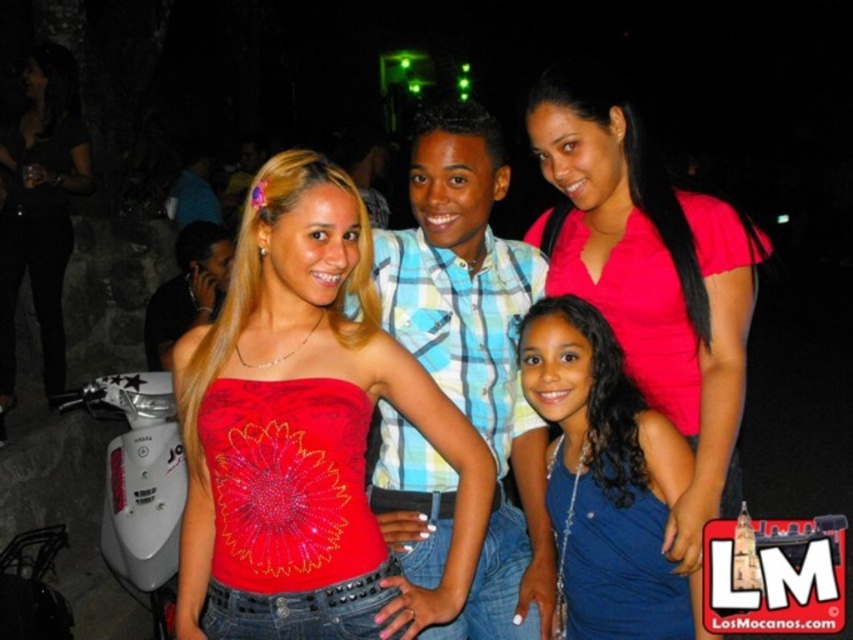
Between blue satin dress at lower right and matte black dress at center, which one has more height?

matte black dress at center is taller.

Is point (572, 605) positioned in front of point (61, 358)?

Yes.

Where is `blue satin dress at lower right`? The image size is (853, 640). blue satin dress at lower right is located at coordinates (606, 481).

Is shiny red fabric top at center shorter than blue satin dress at lower right?

No, shiny red fabric top at center is not shorter than blue satin dress at lower right.

Who is positioned more to the left, shiny red fabric top at center or blue satin dress at lower right?

shiny red fabric top at center is more to the left.

Does point (344, 257) come farther from viewer compared to point (704, 634)?

No.

Where is `shiny red fabric top at center`? shiny red fabric top at center is located at coordinates (306, 422).

Measure the distance between pink satin blouse at upper right and camera.

pink satin blouse at upper right and camera are 2.10 meters apart from each other.

Locate an element on the screen. pink satin blouse at upper right is located at coordinates (650, 275).